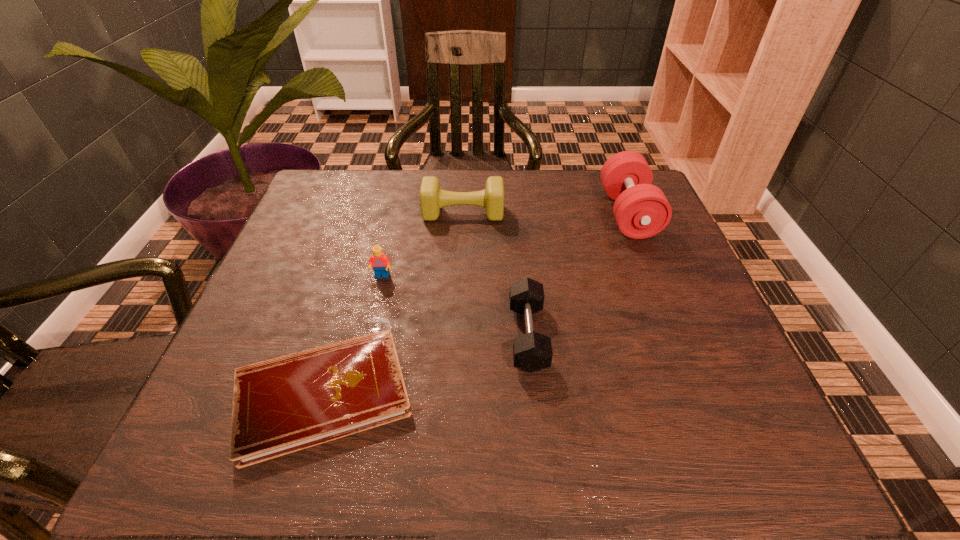
Locate an element on the screen. free space located on the right of the shortest dumbbell is located at coordinates coord(697,336).

Identify the location of vacant area located on the back of the notebook. (352, 295).

The width and height of the screenshot is (960, 540). Identify the location of object that is at the near edge. (283, 405).

The image size is (960, 540). Find the location of `object situated at the left edge`. object situated at the left edge is located at coordinates (283, 405).

Locate an element on the screen. The image size is (960, 540). object positioned at the right edge is located at coordinates (641, 210).

Locate an element on the screen. object present at the near left corner is located at coordinates (283, 405).

Identify the location of object at the far right corner. The height and width of the screenshot is (540, 960). (641, 210).

This screenshot has height=540, width=960. In the image, there is a desktop. In order to click on vacant space at the far edge in this screenshot , I will do `click(517, 189)`.

This screenshot has width=960, height=540. Find the location of `free space at the near edge of the desktop`. free space at the near edge of the desktop is located at coordinates (438, 442).

The width and height of the screenshot is (960, 540). Find the location of `vacant space at the right edge`. vacant space at the right edge is located at coordinates coord(727,357).